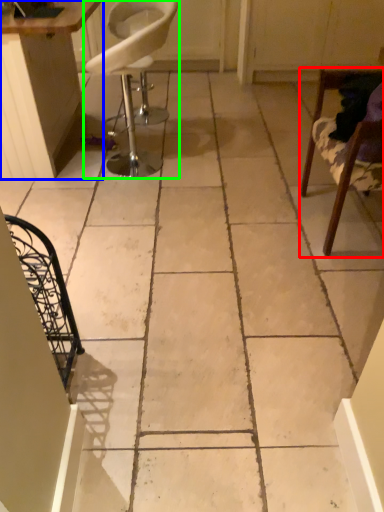
Question: Which object is positioned farthest from chair (highlighted by a red box)? Select from table (highlighted by a blue box) and chair (highlighted by a green box).

Choices:
 (A) table
 (B) chair

Answer: (B)